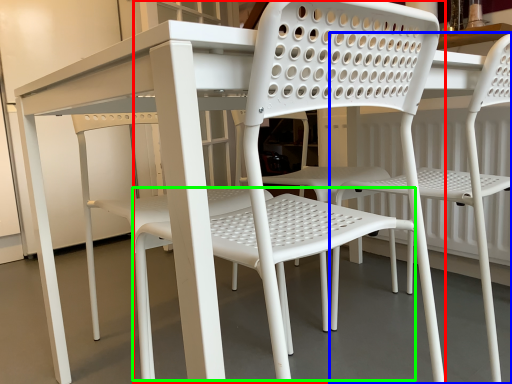
Question: Which object is the closest to the chair (highlighted by a red box)? Choose among these: chair (highlighted by a blue box) or bar stool (highlighted by a green box).

Choices:
 (A) chair
 (B) bar stool

Answer: (B)